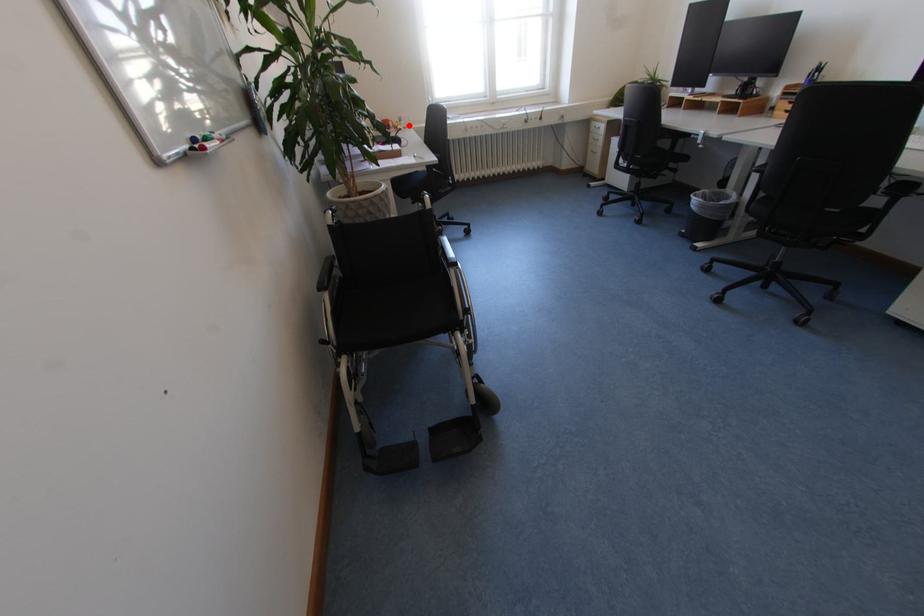
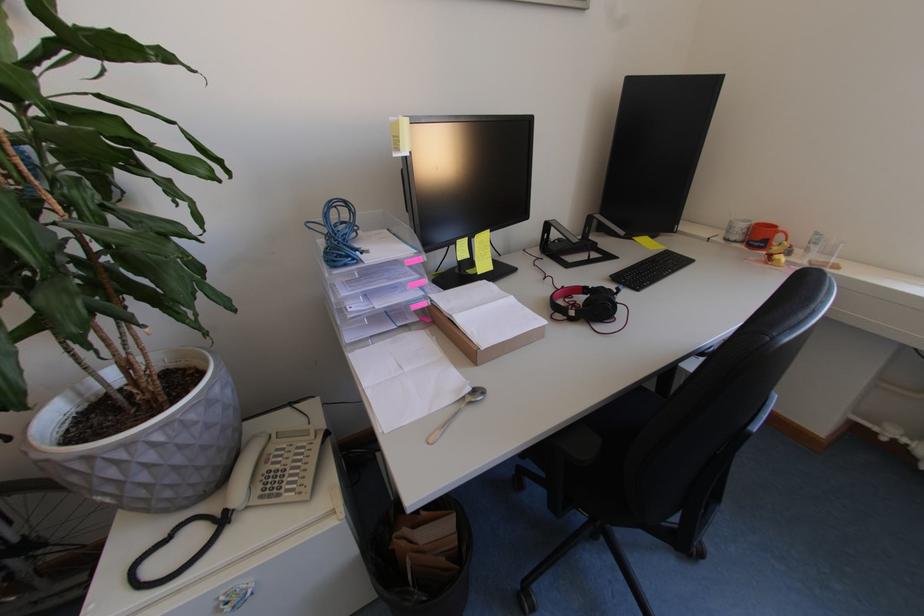
Where in the second image is the point corresponding to the highlighted location from the first image?

(816, 253)